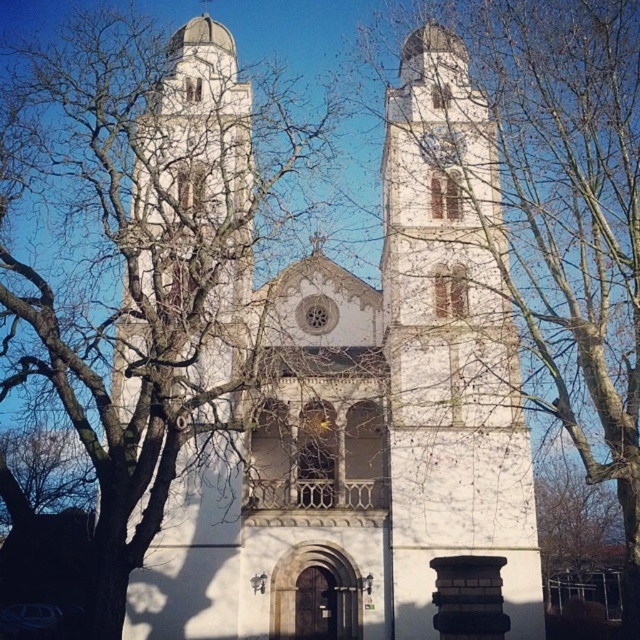
Which of these two, white stone church at center or bare branches at left, stands taller?

With more height is white stone church at center.

Between point (209, 573) and point (177, 61), which one is positioned behind?

Point (177, 61)

Is point (416, 468) closer to viewer compared to point (179, 64)?

Yes, it is in front of point (179, 64).

I want to click on white stone church at center, so pyautogui.click(x=371, y=416).

Who is taller, white stone church at center or white stone tower at center?

white stone church at center

Between point (161, 561) and point (412, 428), which one is positioned in front?

Point (161, 561) is more forward.

This screenshot has height=640, width=640. Identify the location of white stone church at center. (371, 416).

Which of these two, white stone tower at center or bare branches at left, stands shorter?

white stone tower at center is shorter.

Between point (449, 147) and point (232, 189), which one is positioned in front?

Point (232, 189) is more forward.

The width and height of the screenshot is (640, 640). What are the coordinates of `white stone tower at center` in the screenshot? It's located at (451, 346).